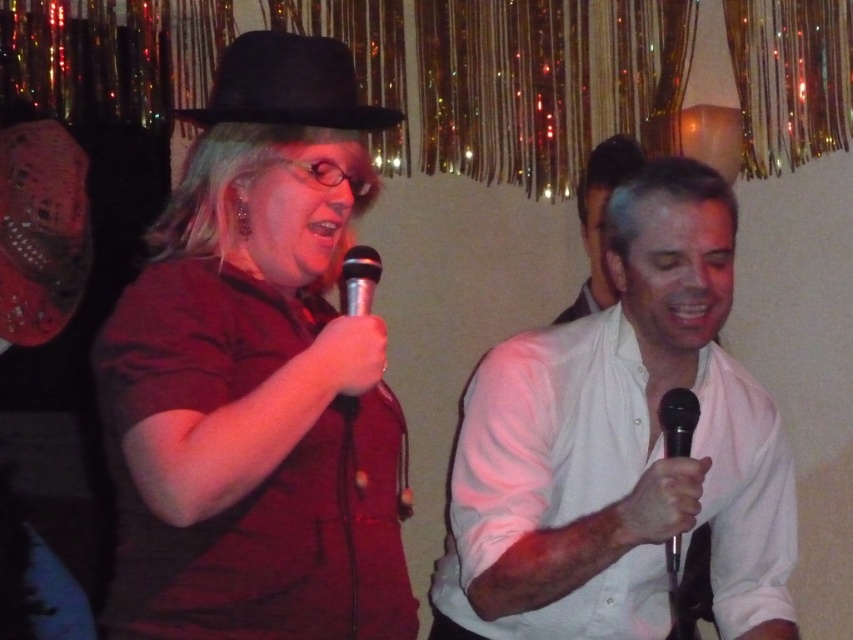
Which of these two, white glossy shirt at right or black metallic microphone at center, stands taller?

Standing taller between the two is white glossy shirt at right.

Describe the element at coordinates (621, 448) in the screenshot. Image resolution: width=853 pixels, height=640 pixels. I see `white glossy shirt at right` at that location.

Find the location of a particular element. white glossy shirt at right is located at coordinates (621, 448).

Does matte black hat at left have a lesser width compared to white shirt at right?

No, matte black hat at left is not thinner than white shirt at right.

Who is more forward, (112, 337) or (570, 316)?

Point (112, 337)

Identify the location of matte black hat at left. (257, 376).

The width and height of the screenshot is (853, 640). In order to click on matte black hat at left in this screenshot , I will do `click(257, 376)`.

Looking at this image, does white glossy shirt at right appear on the left side of black metallic microphone at upper center?

No, white glossy shirt at right is not to the left of black metallic microphone at upper center.

Is white glossy shirt at right below black metallic microphone at upper center?

Indeed, white glossy shirt at right is positioned under black metallic microphone at upper center.

What do you see at coordinates (621, 448) in the screenshot?
I see `white glossy shirt at right` at bounding box center [621, 448].

Find the location of a particular element. The width and height of the screenshot is (853, 640). white glossy shirt at right is located at coordinates (621, 448).